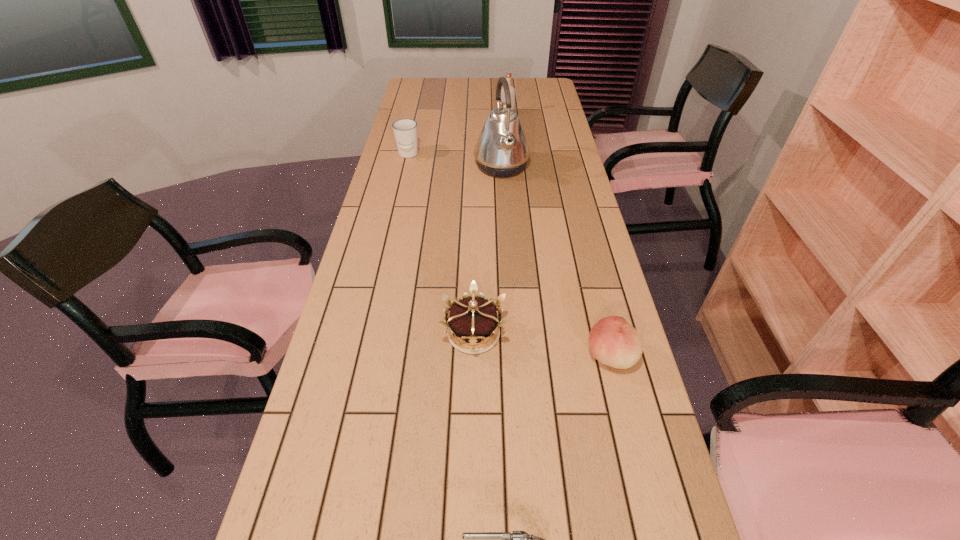
At what (x,y) coordinates should I click in order to perform the action: click on vacant space located 0.340m with a handle on the side of the cup. Please return your answer as a coordinate pair (x, y). The width and height of the screenshot is (960, 540). Looking at the image, I should click on (395, 217).

Locate an element on the screen. blank area located on the back of the crown is located at coordinates [475, 220].

Where is `vacant space situated 0.060m on the left of the peach`? vacant space situated 0.060m on the left of the peach is located at coordinates (561, 356).

Find the location of a particular element. object located at the left edge is located at coordinates (405, 130).

Find the location of `object situated at the right edge`. object situated at the right edge is located at coordinates (612, 341).

In the image, there is a desktop. Identify the location of free region at the far edge. (456, 90).

At what (x,y) coordinates should I click in order to perform the action: click on vacant area at the left edge of the desktop. Please return your answer as a coordinate pair (x, y). Looking at the image, I should click on (428, 104).

Where is `blank space at the right edge`? blank space at the right edge is located at coordinates (547, 210).

Locate an element on the screen. This screenshot has width=960, height=540. free spot at the far left corner of the desktop is located at coordinates (420, 78).

The image size is (960, 540). What are the coordinates of `free space between the kettle and the crown` in the screenshot? It's located at (488, 250).